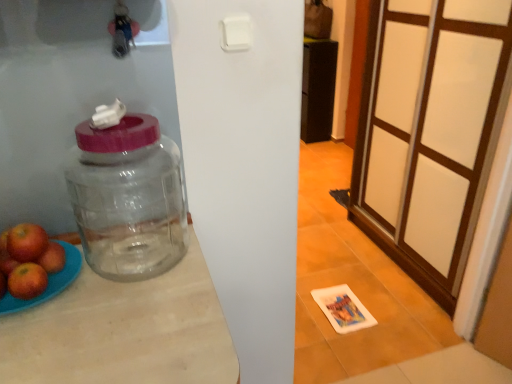
Question: Considering the relative sizes of transparent glass jar at left and clear wood table at center in the image provided, is transparent glass jar at left smaller than clear wood table at center?

Choices:
 (A) yes
 (B) no

Answer: (A)

Question: From the image's perspective, is transparent glass jar at left below clear wood table at center?

Choices:
 (A) no
 (B) yes

Answer: (A)

Question: Is transparent glass jar at left far away from clear wood table at center?

Choices:
 (A) no
 (B) yes

Answer: (A)

Question: From a real-world perspective, is transparent glass jar at left positioned over clear wood table at center based on gravity?

Choices:
 (A) no
 (B) yes

Answer: (B)

Question: Is clear wood table at center completely or partially inside transparent glass jar at left?

Choices:
 (A) yes
 (B) no

Answer: (B)

Question: Could you tell me if transparent glass jar at left is facing clear wood table at center?

Choices:
 (A) no
 (B) yes

Answer: (A)

Question: Considering the relative sizes of red matte apple at left, placed as the first apple when sorted from right to left, and transparent glass jar at left in the image provided, is red matte apple at left, placed as the first apple when sorted from right to left, wider than transparent glass jar at left?

Choices:
 (A) no
 (B) yes

Answer: (A)

Question: From a real-world perspective, is red matte apple at left, which appears as the third apple when viewed from the left, physically above transparent glass jar at left?

Choices:
 (A) no
 (B) yes

Answer: (A)

Question: Can you confirm if red matte apple at left, placed as the first apple when sorted from right to left, is thinner than transparent glass jar at left?

Choices:
 (A) no
 (B) yes

Answer: (B)

Question: Is red matte apple at left, placed as the first apple when sorted from right to left, far away from transparent glass jar at left?

Choices:
 (A) yes
 (B) no

Answer: (B)

Question: Is red matte apple at left, placed as the first apple when sorted from right to left, directly adjacent to transparent glass jar at left?

Choices:
 (A) yes
 (B) no

Answer: (B)

Question: Can you confirm if red matte apple at left, placed as the first apple when sorted from right to left, is taller than transparent glass jar at left?

Choices:
 (A) no
 (B) yes

Answer: (A)

Question: Considering the relative sizes of red matte apple at left, marked as the third apple in a right-to-left arrangement, and transparent glass jar at left in the image provided, is red matte apple at left, marked as the third apple in a right-to-left arrangement, wider than transparent glass jar at left?

Choices:
 (A) yes
 (B) no

Answer: (A)